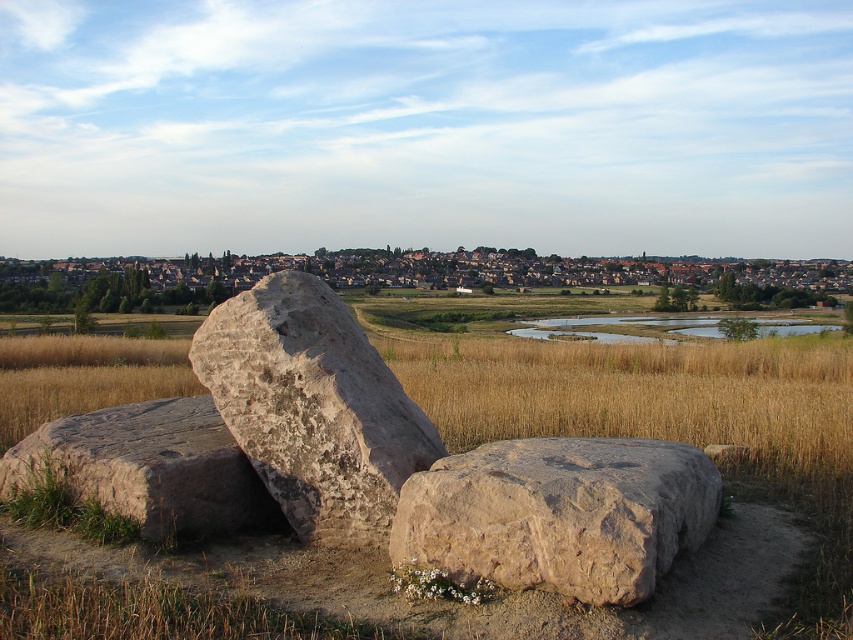
Question: Is brown grass at center below brown rough stone at lower left?

Choices:
 (A) no
 (B) yes

Answer: (A)

Question: Does brown rough boulder at center have a greater width compared to brown rough rock at center?

Choices:
 (A) no
 (B) yes

Answer: (B)

Question: Is the position of brown grass at center more distant than that of brown rough rock at center?

Choices:
 (A) no
 (B) yes

Answer: (A)

Question: Among these objects, which one is nearest to the camera?

Choices:
 (A) brown rough boulder at center
 (B) brown grass at center

Answer: (A)

Question: Which is nearer to the brown rough rock at center?

Choices:
 (A) brown rough stone at lower left
 (B) brown grass at center

Answer: (A)

Question: Which of the following is the closest to the observer?

Choices:
 (A) brown rough rock at center
 (B) brown rough boulder at center

Answer: (B)